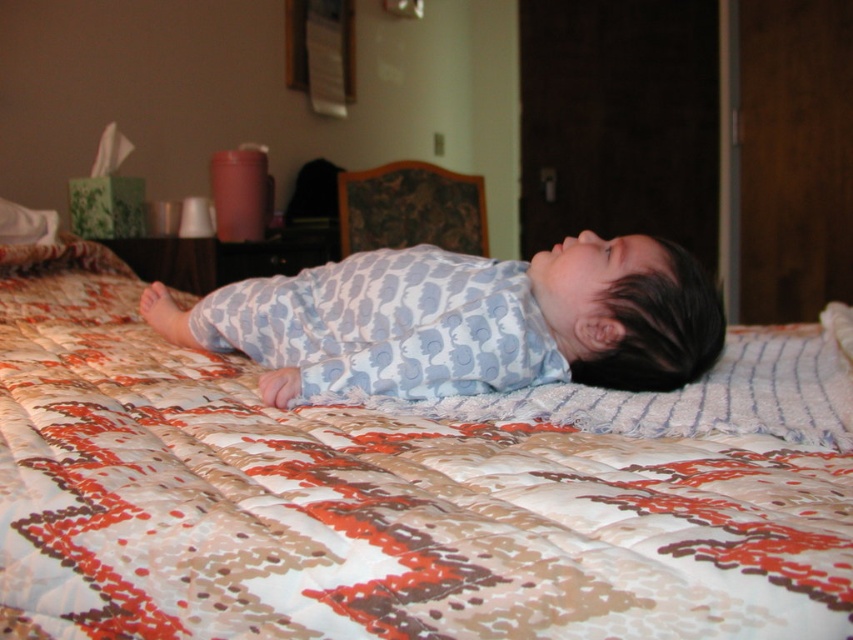
You are a photographer taking a picture of the bed. You notice two points on the bedspread marked as point (x=676, y=472) and point (x=500, y=326). Which point will appear larger in your photo?

Point (x=676, y=472) is closer to the camera than point (x=500, y=326), so it will appear larger in the photo.

From the picture: You are a parent trying to decide whether to place a small stuffed animal between the printed cotton quilt at center and the blue cotton onesie at center. Based on their sizes, will the stuffed animal fit comfortably between them?

The printed cotton quilt at center is taller than the blue cotton onesie at center, so there should be enough space between them to place a small stuffed animal comfortably.